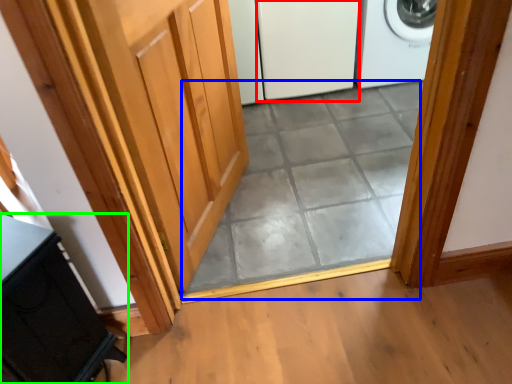
Question: Which object is the closest to the screen door (highlighted by a red box)? Choose among these: tile (highlighted by a blue box) or cabinetry (highlighted by a green box).

Choices:
 (A) tile
 (B) cabinetry

Answer: (A)